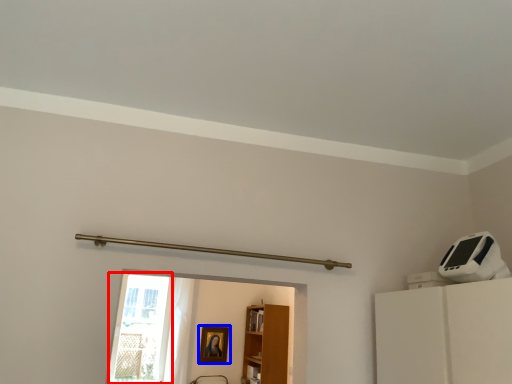
Question: Which point is closer to the camera, glass door (highlighted by a red box) or picture frame (highlighted by a blue box)?

Choices:
 (A) glass door
 (B) picture frame

Answer: (A)